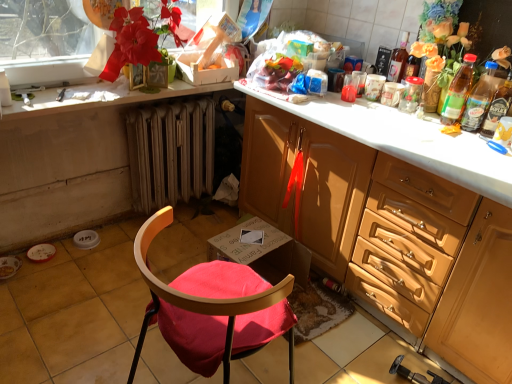
Question: Is matte red flower at upper left next to metallic radiator at lower center?

Choices:
 (A) yes
 (B) no

Answer: (B)

Question: Can you confirm if matte red flower at upper left is bigger than metallic radiator at lower center?

Choices:
 (A) no
 (B) yes

Answer: (A)

Question: From the image's perspective, is matte red flower at upper left above metallic radiator at lower center?

Choices:
 (A) yes
 (B) no

Answer: (A)

Question: Can you confirm if matte red flower at upper left is taller than metallic radiator at lower center?

Choices:
 (A) no
 (B) yes

Answer: (A)

Question: Is matte red flower at upper left outside of metallic radiator at lower center?

Choices:
 (A) yes
 (B) no

Answer: (A)

Question: Is metallic radiator at lower center at the back of matte red flower at upper left?

Choices:
 (A) no
 (B) yes

Answer: (A)

Question: Is white glossy countertop at upper left oriented away from transparent plastic jar at upper right?

Choices:
 (A) yes
 (B) no

Answer: (B)

Question: Is white glossy countertop at upper left to the left of transparent plastic jar at upper right from the viewer's perspective?

Choices:
 (A) yes
 (B) no

Answer: (A)

Question: Is the position of white glossy countertop at upper left more distant than that of transparent plastic jar at upper right?

Choices:
 (A) no
 (B) yes

Answer: (A)

Question: Is white glossy countertop at upper left bigger than transparent plastic jar at upper right?

Choices:
 (A) yes
 (B) no

Answer: (A)

Question: From the image's perspective, is white glossy countertop at upper left below transparent plastic jar at upper right?

Choices:
 (A) no
 (B) yes

Answer: (A)

Question: Is white glossy countertop at upper left thinner than transparent plastic jar at upper right?

Choices:
 (A) no
 (B) yes

Answer: (A)

Question: Is translucent plastic bottle at right, which is the 3th bottle from left to right, at the right side of transparent plastic jar at upper right?

Choices:
 (A) no
 (B) yes

Answer: (B)